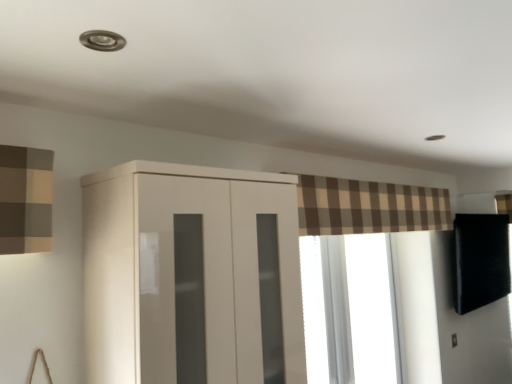
Question: From the image's perspective, is glossy white cupboard at center located above or below transparent glass window at center?

Choices:
 (A) below
 (B) above

Answer: (B)

Question: Choose the correct answer: Is glossy white cupboard at center inside transparent glass window at center or outside it?

Choices:
 (A) outside
 (B) inside

Answer: (A)

Question: Which object is the closest to the glossy white cupboard at center?

Choices:
 (A) transparent glass window at center
 (B) brown plaid curtain at upper center

Answer: (B)

Question: Considering the real-world distances, which object is farthest from the transparent glass window at center?

Choices:
 (A) brown plaid curtain at upper center
 (B) glossy white cupboard at center

Answer: (B)